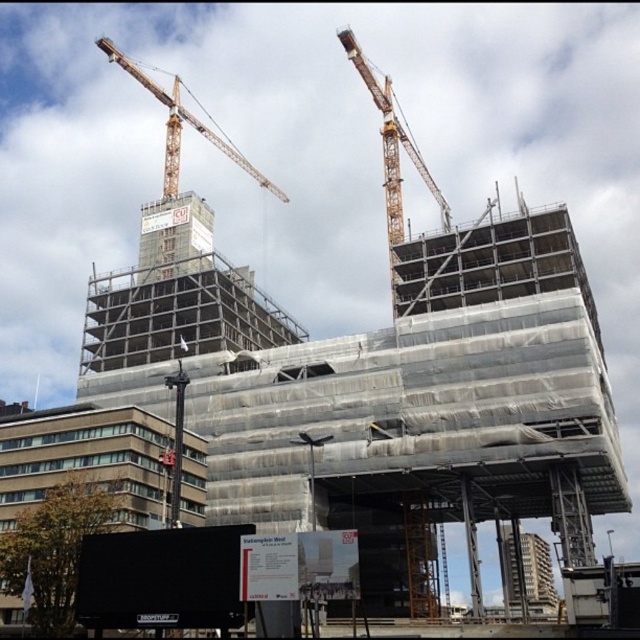
You are a surveyor standing at the center of the construction site. You need to locate the yellow metallic crane at upper center. According to the coordinates provided, where exactly should you look to find it?

The yellow metallic crane at upper center is located at coordinates point (392, 156).

From the picture: You are a construction worker on the site and need to determine which crane can reach higher. Based on the image, which crane is taller between the yellow metallic crane at upper center and the orange metallic crane at upper left?

The yellow metallic crane at upper center is taller than the orange metallic crane at upper left, so it can reach higher.